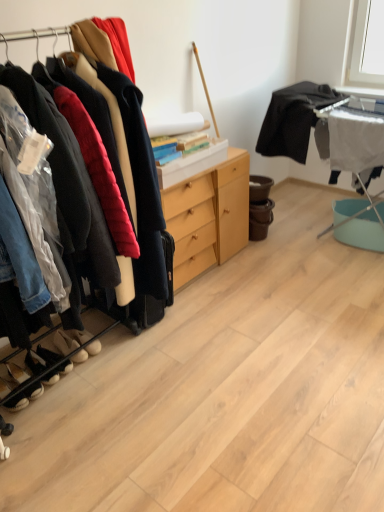
Question: Would you say white suede shoes at lower left, the 1th footwear viewed from the back, contains white fabric ironing board at right?

Choices:
 (A) no
 (B) yes

Answer: (A)

Question: Does white suede shoes at lower left, the 1th footwear viewed from the back, have a greater width compared to white fabric ironing board at right?

Choices:
 (A) no
 (B) yes

Answer: (B)

Question: Considering the relative positions of white suede shoes at lower left, which ranks as the 5th footwear in front-to-back order, and white fabric ironing board at right in the image provided, is white suede shoes at lower left, which ranks as the 5th footwear in front-to-back order, in front of white fabric ironing board at right?

Choices:
 (A) no
 (B) yes

Answer: (B)

Question: Is white suede shoes at lower left, the 1th footwear viewed from the back, smaller than white fabric ironing board at right?

Choices:
 (A) yes
 (B) no

Answer: (A)

Question: Can you confirm if white suede shoes at lower left, which ranks as the 5th footwear in front-to-back order, is bigger than white fabric ironing board at right?

Choices:
 (A) no
 (B) yes

Answer: (A)

Question: Is there a large distance between white suede shoes at lower left, the 1th footwear viewed from the back, and white fabric ironing board at right?

Choices:
 (A) no
 (B) yes

Answer: (B)

Question: Is white suede shoes at lower left, which ranks as the 5th footwear in front-to-back order, wider than light wood/finely finished cabinet at center?

Choices:
 (A) no
 (B) yes

Answer: (A)

Question: From a real-world perspective, is white suede shoes at lower left, which ranks as the 5th footwear in front-to-back order, on light wood/finely finished cabinet at center?

Choices:
 (A) yes
 (B) no

Answer: (B)

Question: Is white suede shoes at lower left, which ranks as the 5th footwear in front-to-back order, aimed at light wood/finely finished cabinet at center?

Choices:
 (A) yes
 (B) no

Answer: (B)

Question: Is light wood/finely finished cabinet at center at the back of white suede shoes at lower left, which ranks as the 5th footwear in front-to-back order?

Choices:
 (A) yes
 (B) no

Answer: (B)

Question: Does white suede shoes at lower left, which ranks as the 5th footwear in front-to-back order, have a lesser width compared to light wood/finely finished cabinet at center?

Choices:
 (A) yes
 (B) no

Answer: (A)

Question: From a real-world perspective, is white suede shoes at lower left, the 1th footwear viewed from the back, physically below light wood/finely finished cabinet at center?

Choices:
 (A) no
 (B) yes

Answer: (B)

Question: From a real-world perspective, is black suede shoes at lower left, which appears as the second footwear when viewed from the front, below white fabric ironing board at right?

Choices:
 (A) no
 (B) yes

Answer: (B)